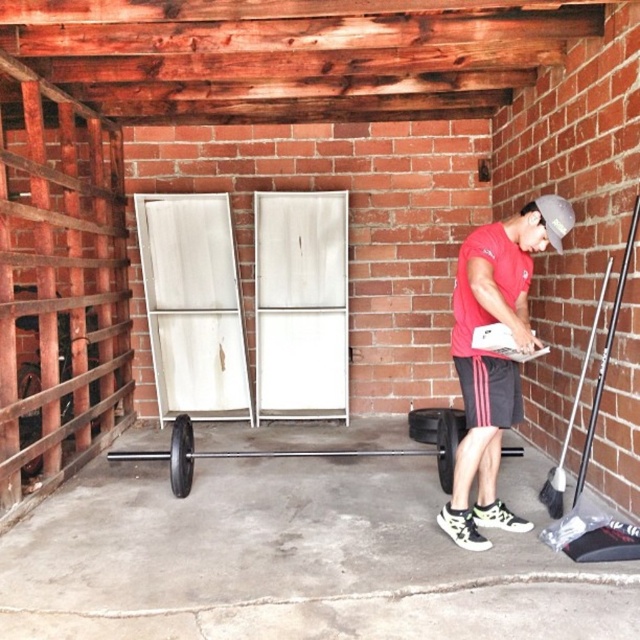
Question: Among these objects, which one is nearest to the camera?

Choices:
 (A) red matte shirt at center
 (B) black rubber wheel at lower left

Answer: (A)

Question: Can you confirm if red matte shirt at center is positioned below black metal barbell at center?

Choices:
 (A) yes
 (B) no

Answer: (B)

Question: Which point is closer to the camera?

Choices:
 (A) [x=189, y=449]
 (B) [x=500, y=387]

Answer: (B)

Question: Among these objects, which one is farthest from the camera?

Choices:
 (A) red matte shirt at center
 (B) black metal barbell at center
 (C) black rubber wheel at left

Answer: (C)

Question: Can you confirm if black metal barbell at center is positioned to the right of black rubber wheel at left?

Choices:
 (A) no
 (B) yes

Answer: (B)

Question: Is black rubber wheel at left above black rubber wheel at lower center?

Choices:
 (A) yes
 (B) no

Answer: (A)